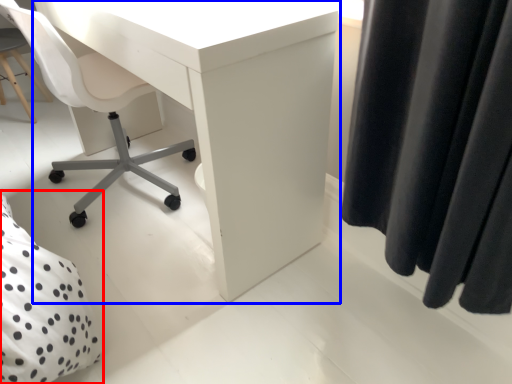
Question: Which point is further to the camera, bed (highlighted by a red box) or desk (highlighted by a blue box)?

Choices:
 (A) bed
 (B) desk

Answer: (B)